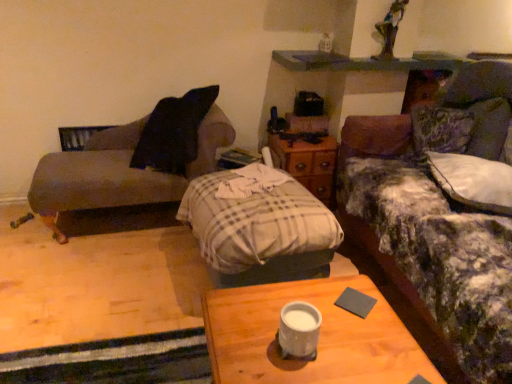
Where is `vacant region to the left of white matte coffee cup at center`? The image size is (512, 384). vacant region to the left of white matte coffee cup at center is located at coordinates (243, 338).